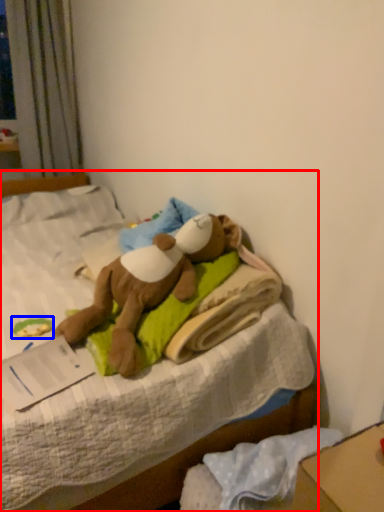
Question: Which object appears farthest to the camera in this image, bed (highlighted by a red box) or toy (highlighted by a blue box)?

Choices:
 (A) bed
 (B) toy

Answer: (B)